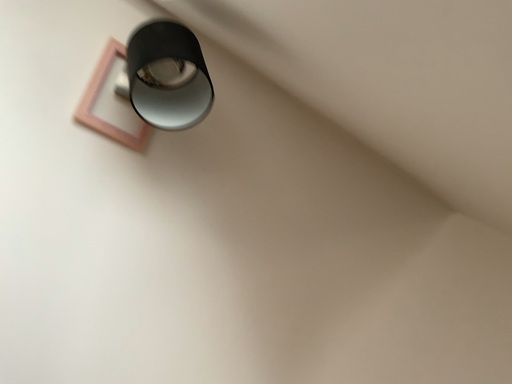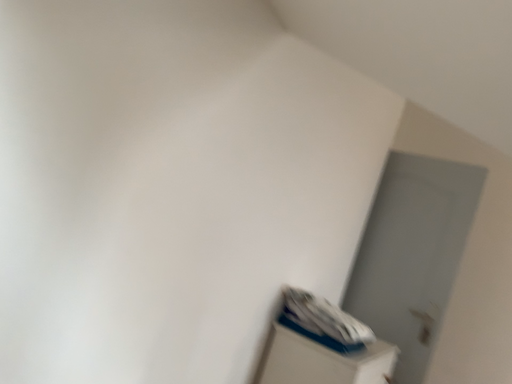
Question: How did the camera likely rotate when shooting the video?

Choices:
 (A) rotated left
 (B) rotated right

Answer: (B)